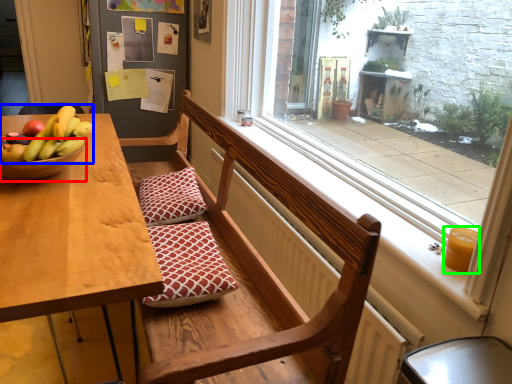
Question: Considering the real-world distances, which object is farthest from glass bowl (highlighted by a red box)? banana (highlighted by a blue box) or candle holder (highlighted by a green box)?

Choices:
 (A) banana
 (B) candle holder

Answer: (B)